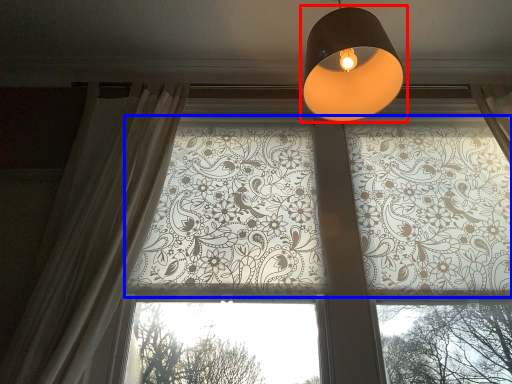
Question: Which object is further to the camera taking this photo, lamp (highlighted by a red box) or bay window (highlighted by a blue box)?

Choices:
 (A) lamp
 (B) bay window

Answer: (B)